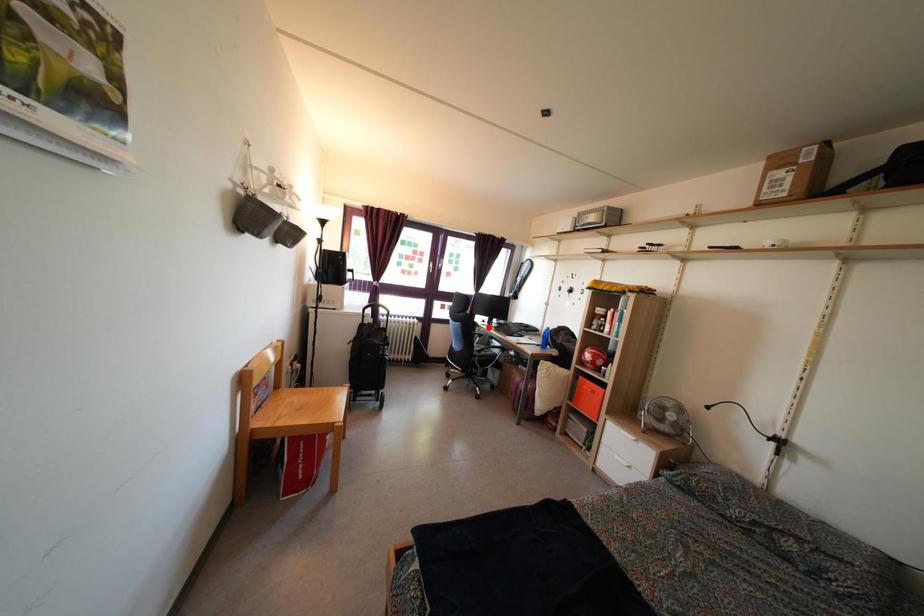
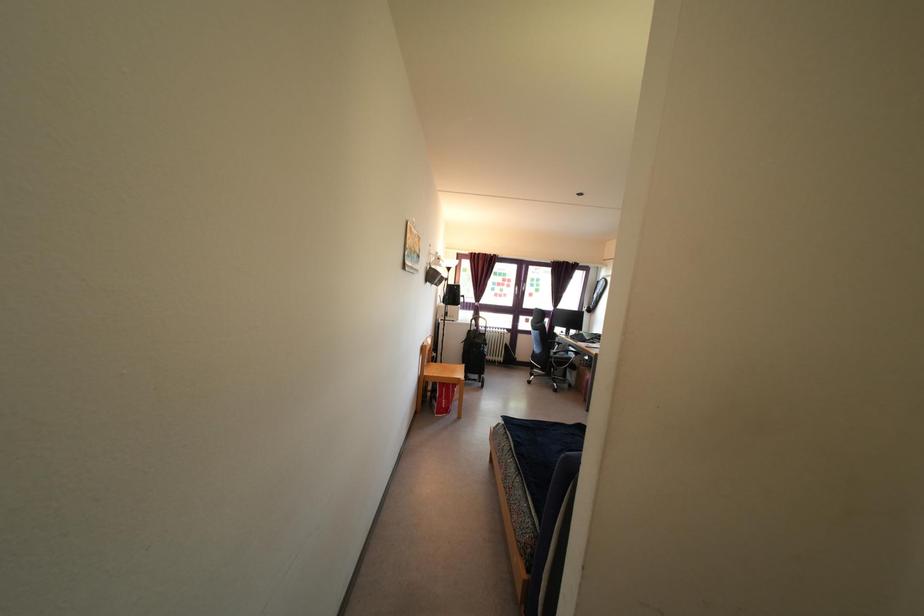
In the second image, find the point that corresponds to the highlighted location in the first image.

(566, 338)